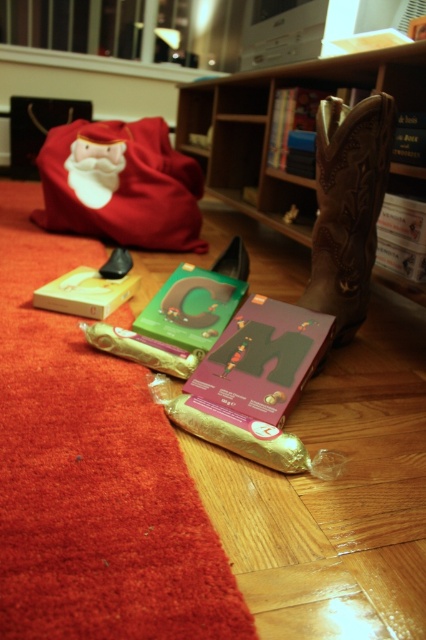
Question: Among these objects, which one is farthest from the camera?

Choices:
 (A) matte yellow book at lower left
 (B) red fabric santa bag at upper left

Answer: (B)

Question: Is brown leather cowboy boot at right below matte purple cardboard letter m at center?

Choices:
 (A) no
 (B) yes

Answer: (A)

Question: Among these objects, which one is nearest to the camera?

Choices:
 (A) matte purple cardboard letter m at center
 (B) red fabric santa bag at upper left
 (C) matte yellow book at lower left
 (D) green matte book at center

Answer: (A)

Question: Based on their relative distances, which object is farther from the brown leather cowboy boot at right?

Choices:
 (A) red fabric santa bag at upper left
 (B) matte purple cardboard letter m at center
 (C) matte yellow book at lower left

Answer: (A)

Question: Is brown leather bookshelf at upper center in front of brown leather cowboy boot at right?

Choices:
 (A) yes
 (B) no

Answer: (B)

Question: Does red fabric santa bag at upper left lie in front of matte purple cardboard letter m at center?

Choices:
 (A) no
 (B) yes

Answer: (A)